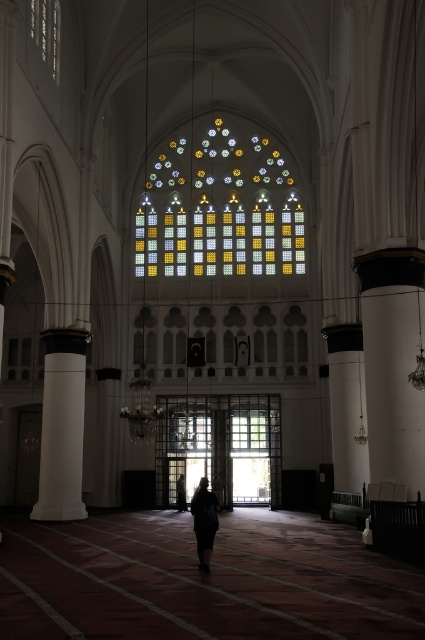
Question: Is multicolored stained glass at center in front of white glossy column at left?

Choices:
 (A) no
 (B) yes

Answer: (A)

Question: From the image, what is the correct spatial relationship of multicolored stained glass at center in relation to stained glass window at upper center?

Choices:
 (A) above
 (B) below

Answer: (B)

Question: Estimate the real-world distances between objects in this image. Which object is farther from the white glossy column at left?

Choices:
 (A) multicolored stained glass at center
 (B) dark fabric person at center
 (C) clear glass door at center

Answer: (A)

Question: Which object is positioned farthest from the dark fabric person at center?

Choices:
 (A) multicolored stained glass at center
 (B) white glossy column at left
 (C) stained glass window at upper center

Answer: (C)

Question: Which point is closer to the camera taking this photo?

Choices:
 (A) (56, 80)
 (B) (71, 426)
 (C) (348, 372)

Answer: (A)

Question: Can you confirm if multicolored stained glass at center is positioned to the left of clear glass door at center?

Choices:
 (A) no
 (B) yes

Answer: (B)